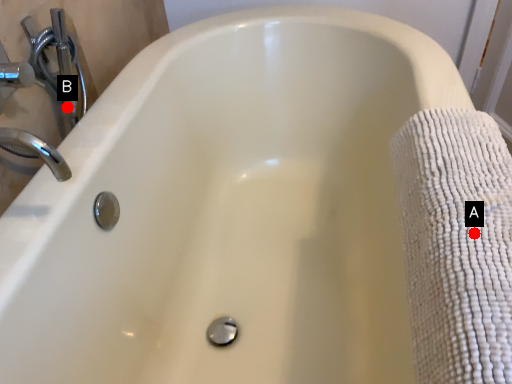
Question: Two points are circled on the image, labeled by A and B beside each circle. Among these points, which one is farthest from the camera?

Choices:
 (A) A is further
 (B) B is further

Answer: (B)